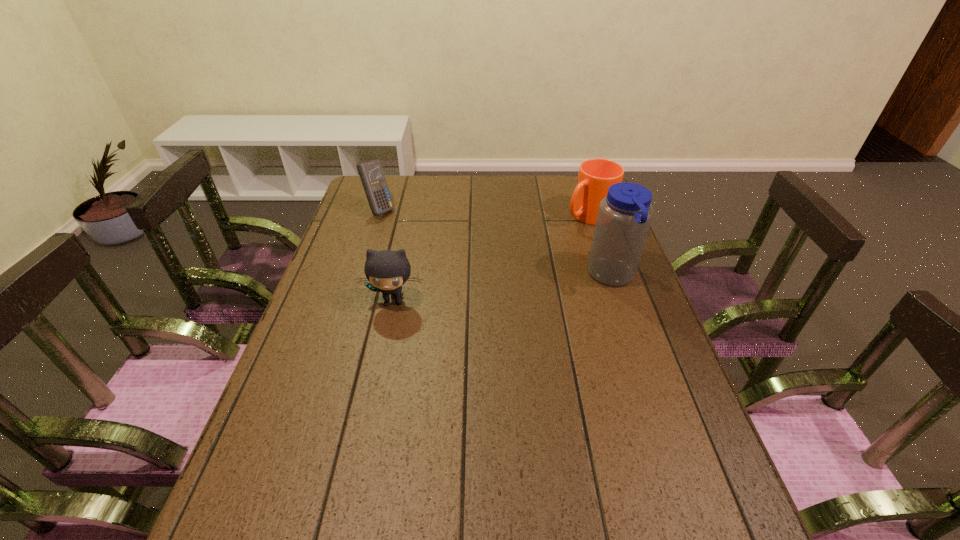
The width and height of the screenshot is (960, 540). I want to click on free space between the mug and the calculator, so click(x=484, y=213).

At what (x,y) coordinates should I click in order to perform the action: click on empty location between the mug and the kitten. Please return your answer as a coordinate pair (x, y). Image resolution: width=960 pixels, height=540 pixels. Looking at the image, I should click on (492, 258).

Where is `vacant area that lies between the calculator and the mug`? The width and height of the screenshot is (960, 540). vacant area that lies between the calculator and the mug is located at coordinates (484, 213).

Locate an element on the screen. The height and width of the screenshot is (540, 960). vacant area that lies between the mug and the calculator is located at coordinates (484, 213).

Identify the location of object that is the second nearest to the calculator. (595, 176).

Locate which object is the closest to the kitten. Please provide its 2D coordinates. Your answer should be formatted as a tuple, i.e. [(x, y)], where the tuple contains the x and y coordinates of a point satisfying the conditions above.

[(371, 174)]

Locate an element on the screen. free space that satisfies the following two spatial constraints: 1. on the front side of the mug; 2. with a carrying loop on the side of the water bottle is located at coordinates (610, 276).